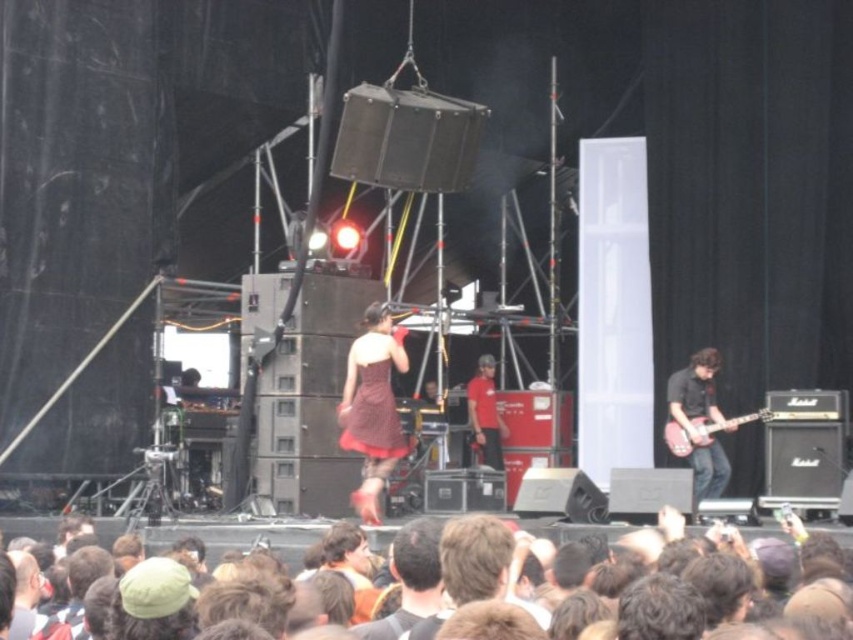
Can you confirm if matte red dress at center is wider than smooth brown hair at center?

In fact, matte red dress at center might be narrower than smooth brown hair at center.

Is matte red dress at center closer to camera compared to smooth brown hair at center?

No.

Which is in front, point (358, 365) or point (397, 616)?

Point (397, 616) is more forward.

Find the location of a particular element. Image resolution: width=853 pixels, height=640 pixels. matte red dress at center is located at coordinates (372, 406).

Does point (247, 532) come closer to viewer compared to point (698, 403)?

Yes, it is in front of point (698, 403).

Does brown hair at lower center have a greater width compared to shiny black guitar at right?

Correct, the width of brown hair at lower center exceeds that of shiny black guitar at right.

Which is in front, point (560, 525) or point (695, 449)?

Point (560, 525) is more forward.

The image size is (853, 640). Identify the location of brown hair at lower center. (241, 536).

Can you confirm if brown hair at lower center is taller than pink glossy electric guitar at right?

In fact, brown hair at lower center may be shorter than pink glossy electric guitar at right.

Does brown hair at lower center have a lesser height compared to pink glossy electric guitar at right?

Yes.

Who is more distant from viewer, (218, 525) or (711, 420)?

The point (711, 420) is more distant.

You are a GUI agent. You are given a task and a screenshot of the screen. Output one action in this format:
    pyautogui.click(x=<x>, y=<y>)
    Task: Click on the brown hair at lower center
    This screenshot has width=853, height=640.
    Given the screenshot: What is the action you would take?
    [x=241, y=536]